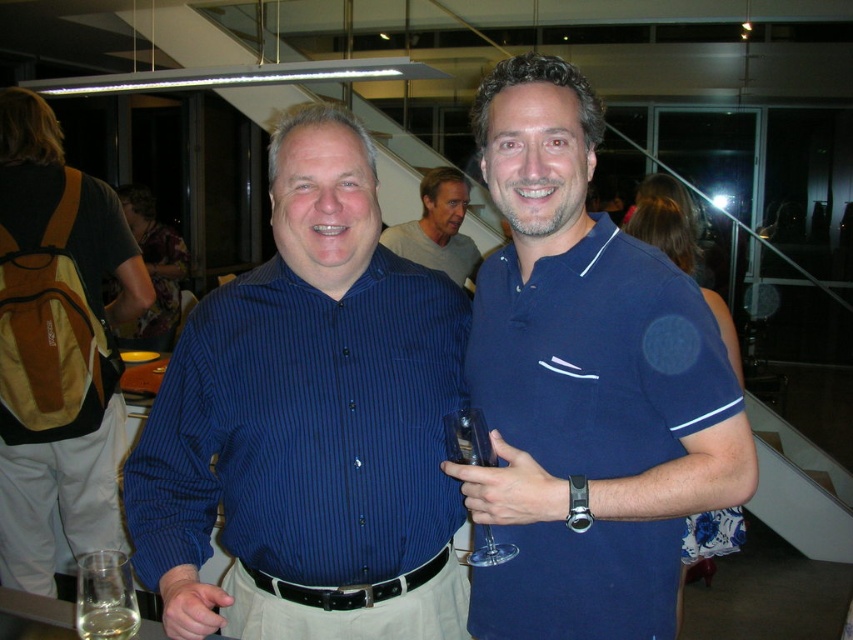
Question: Which of the following is the farthest from the observer?

Choices:
 (A) (132, 605)
 (B) (61, 273)
 (C) (550, 316)

Answer: (B)

Question: Can you confirm if blue striped shirt at center is smaller than brown fabric backpack at left?

Choices:
 (A) no
 (B) yes

Answer: (B)

Question: Is blue cotton polo shirt at center in front of clear glass wine glass at lower left?

Choices:
 (A) no
 (B) yes

Answer: (A)

Question: Which object is farther from the camera taking this photo?

Choices:
 (A) brown fabric backpack at left
 (B) transparent plastic wine glass at center
 (C) clear glass wine glass at lower left
 (D) matte blue shirt at center

Answer: (D)

Question: In this image, where is blue cotton polo shirt at center located relative to translucent glass at lower left?

Choices:
 (A) left
 (B) right

Answer: (B)

Question: Which object is positioned closest to the transparent plastic wine glass at center?

Choices:
 (A) blue striped shirt at center
 (B) blue cotton polo shirt at center
 (C) matte blue shirt at center
 (D) brown fabric backpack at left

Answer: (B)